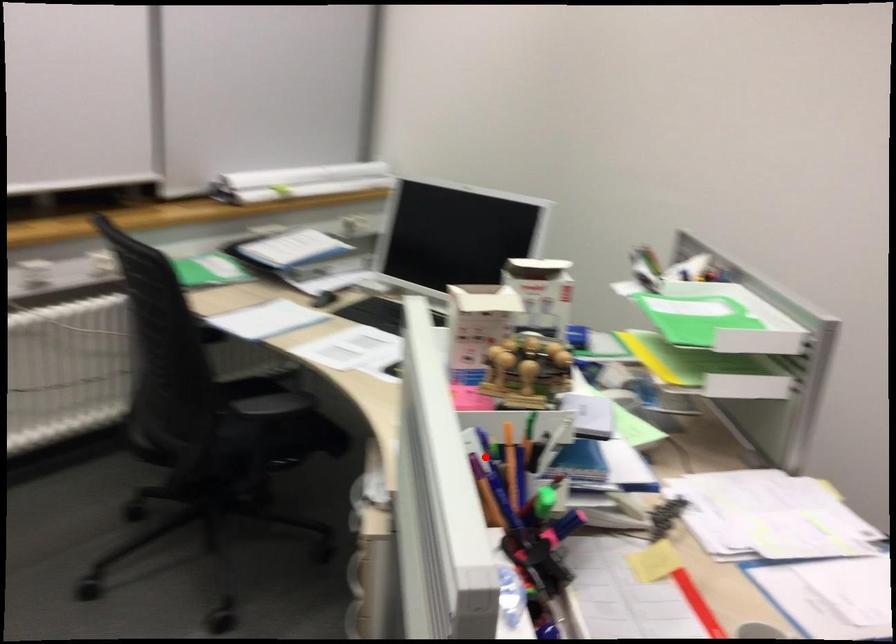
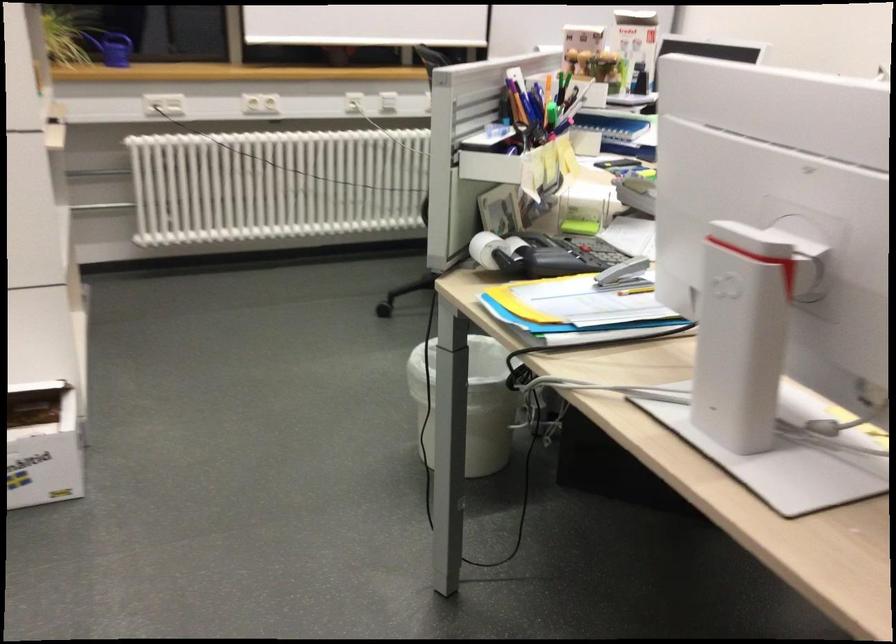
In the second image, find the point that corresponds to the highlighted location in the first image.

(547, 98)